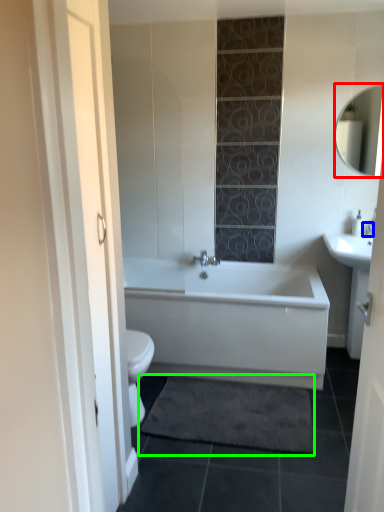
Question: Based on their relative distances, which object is nearer to mirror (highlighted by a red box)? Choose from faucet (highlighted by a blue box) and bath mat (highlighted by a green box).

Choices:
 (A) faucet
 (B) bath mat

Answer: (A)